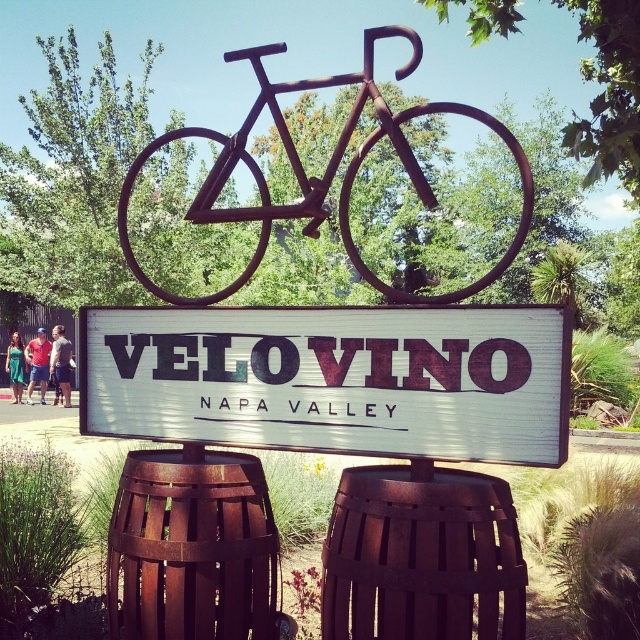
Is rusty wood barrel at center in front of rusty metal bicycle at center?

That is False.

Which is in front, point (253, 529) or point (252, 51)?

Point (253, 529)

Which is in front, point (150, 484) or point (321, 196)?

Positioned in front is point (321, 196).

Where is `rusty wood barrel at center`? rusty wood barrel at center is located at coordinates (193, 547).

Can you confirm if rusty metal barrel at center is positioned above rusty metal bicycle at center?

Incorrect, rusty metal barrel at center is not positioned above rusty metal bicycle at center.

Can you confirm if rusty metal barrel at center is positioned below rusty metal bicycle at center?

Yes, rusty metal barrel at center is below rusty metal bicycle at center.

Between point (406, 584) and point (340, 193), which one is positioned in front?

Point (406, 584) is in front.

Find the location of a particular element. rusty metal barrel at center is located at coordinates (420, 556).

Image resolution: width=640 pixels, height=640 pixels. What do you see at coordinates (420, 556) in the screenshot?
I see `rusty metal barrel at center` at bounding box center [420, 556].

Where is `rusty metal barrel at center`? rusty metal barrel at center is located at coordinates (420, 556).